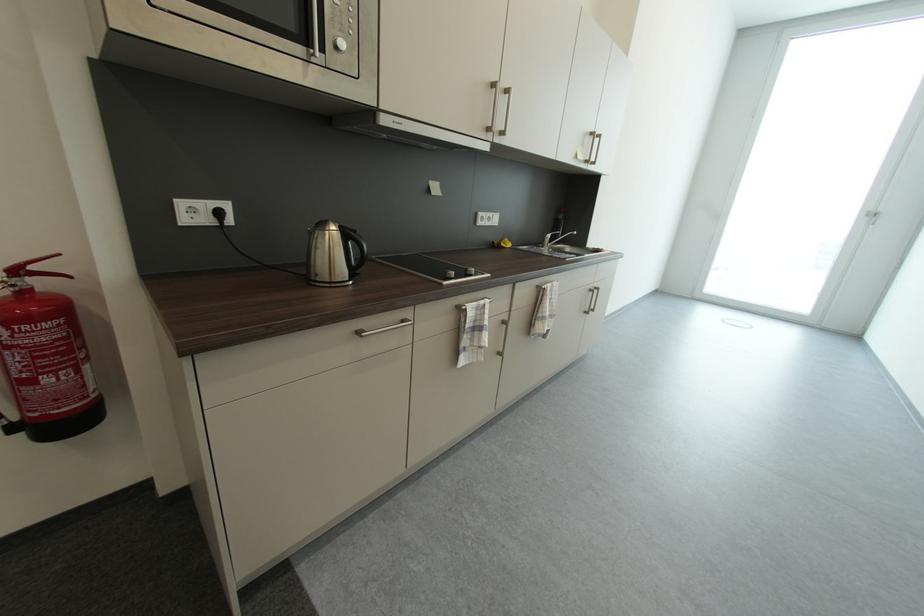
Identify the location of fire extinguisher handle. This screenshot has width=924, height=616. (8, 375).